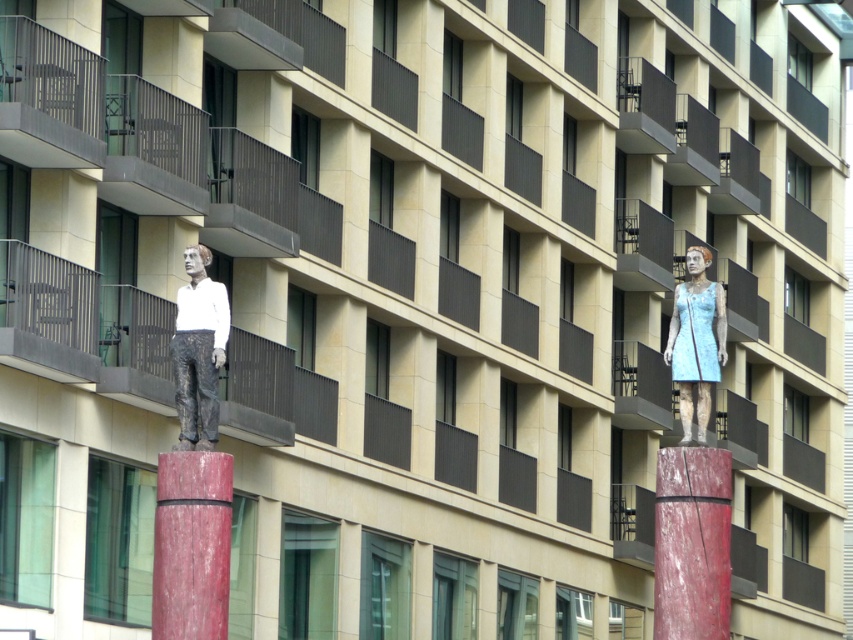
Question: Estimate the real-world distances between objects in this image. Which object is farther from the smooth red wood pillar at center?

Choices:
 (A) matte white statue at center
 (B) smooth red wood at center

Answer: (B)

Question: Which point is farther from the camera taking this photo?

Choices:
 (A) (225, 324)
 (B) (184, 513)
 (C) (703, 314)

Answer: (C)

Question: Does smooth red wood at center appear on the left side of smooth red wood pillar at center?

Choices:
 (A) yes
 (B) no

Answer: (B)

Question: Does matte white statue at center appear on the left side of blue fabric dress at right?

Choices:
 (A) no
 (B) yes

Answer: (B)

Question: Which object is positioned closest to the matte white statue at center?

Choices:
 (A) blue fabric dress at right
 (B) smooth red wood at center

Answer: (B)

Question: Is smooth red wood at center thinner than smooth red wood pillar at center?

Choices:
 (A) no
 (B) yes

Answer: (A)